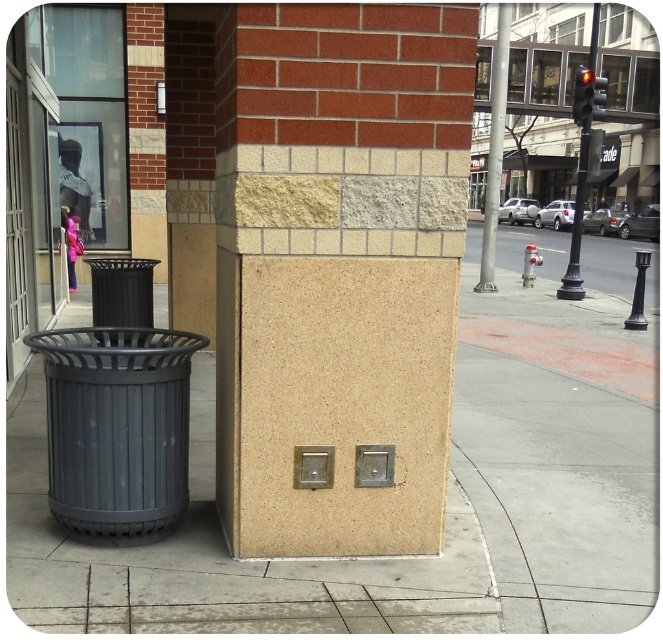
Question: Estimate the real-world distances between objects in this image. Which object is closer to the metallic pole at center?

Choices:
 (A) beige textured pillar at center
 (B) black metal traffic light at upper right

Answer: (B)

Question: Which object is positioned closest to the black metal traffic light at upper right?

Choices:
 (A) metallic pole at center
 (B) beige textured pillar at center

Answer: (A)

Question: Which is nearer to the black metal traffic light at upper right?

Choices:
 (A) beige textured pillar at center
 (B) metallic pole at center

Answer: (B)

Question: Is beige textured pillar at center below metallic pole at center?

Choices:
 (A) yes
 (B) no

Answer: (A)

Question: Can you confirm if beige textured pillar at center is bigger than black metal traffic light at upper right?

Choices:
 (A) no
 (B) yes

Answer: (A)

Question: Is metallic pole at center positioned at the back of black metal traffic light at upper right?

Choices:
 (A) no
 (B) yes

Answer: (A)